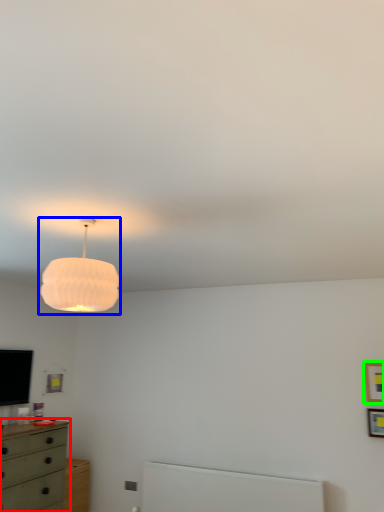
Question: Considering the real-world distances, which object is farthest from chest of drawers (highlighted by a red box)? lamp (highlighted by a blue box) or picture frame (highlighted by a green box)?

Choices:
 (A) lamp
 (B) picture frame

Answer: (B)